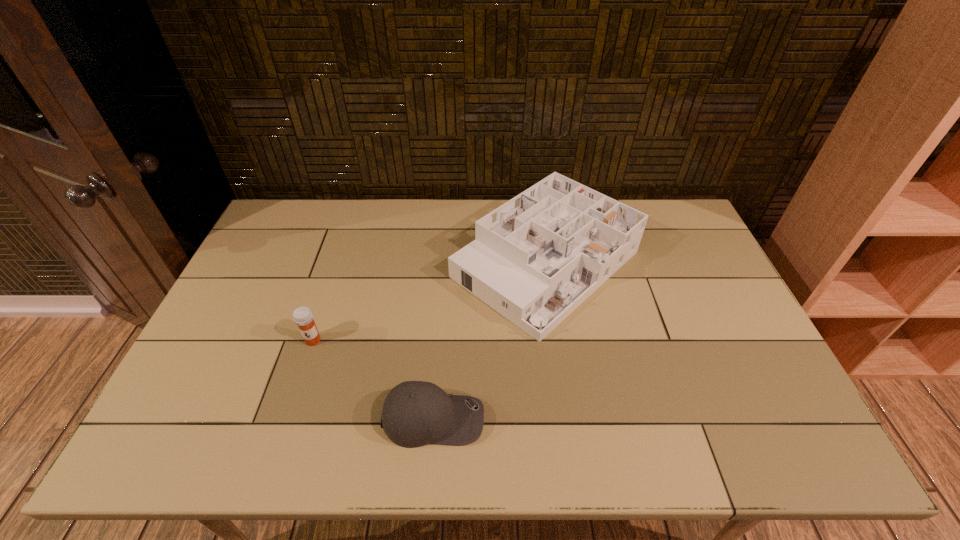
This screenshot has width=960, height=540. I want to click on free space between the medicine and the dollhouse, so click(x=429, y=302).

The image size is (960, 540). In order to click on free area in between the leftmost object and the nearest object in this screenshot , I will do `click(373, 380)`.

What are the coordinates of `vacant space that's between the leftmost object and the dollhouse` in the screenshot? It's located at (429, 302).

In order to click on the closest object to the tallest object in this screenshot , I will do `click(415, 413)`.

The height and width of the screenshot is (540, 960). I want to click on object that can be found as the second closest to the leftmost object, so coord(536,258).